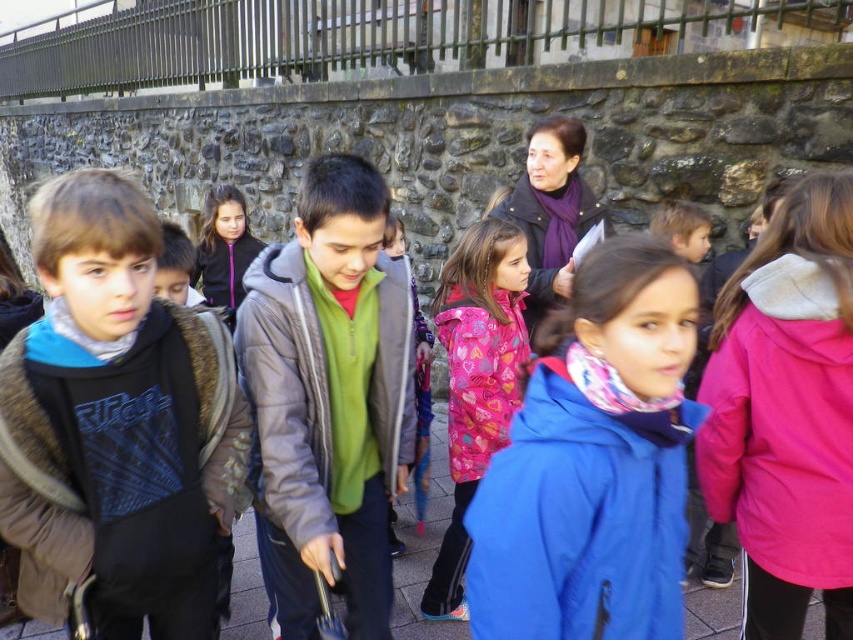
Question: Can you confirm if brown fur-lined jacket at left is positioned below pink fleece jacket at center?

Choices:
 (A) no
 (B) yes

Answer: (B)

Question: Among these objects, which one is nearest to the camera?

Choices:
 (A) blue fleece jacket at center
 (B) green fleece jacket at center
 (C) brown fur-lined jacket at left
 (D) pink fleece jacket at center

Answer: (A)

Question: Which point is farther from the camera taking this photo?

Choices:
 (A) (213, 420)
 (B) (468, 580)

Answer: (A)

Question: Is blue fleece jacket at center bigger than blue fabric jacket at center?

Choices:
 (A) yes
 (B) no

Answer: (A)

Question: Is pink fleece jacket at center behind blue fabric jacket at center?

Choices:
 (A) no
 (B) yes

Answer: (A)

Question: Among these points, which one is farthest from the camera?

Choices:
 (A) (834, 515)
 (B) (357, 508)

Answer: (B)